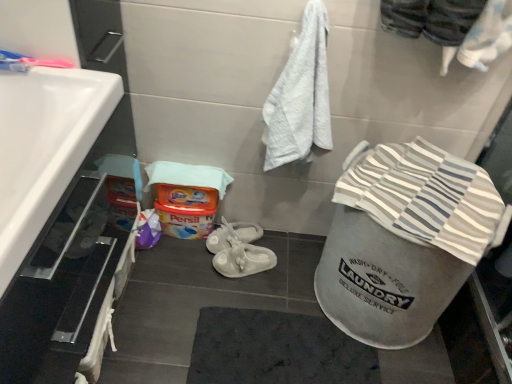
Find the location of a particular element. This screenshot has width=512, height=384. vacant space in front of white rubber sandals at center is located at coordinates (244, 303).